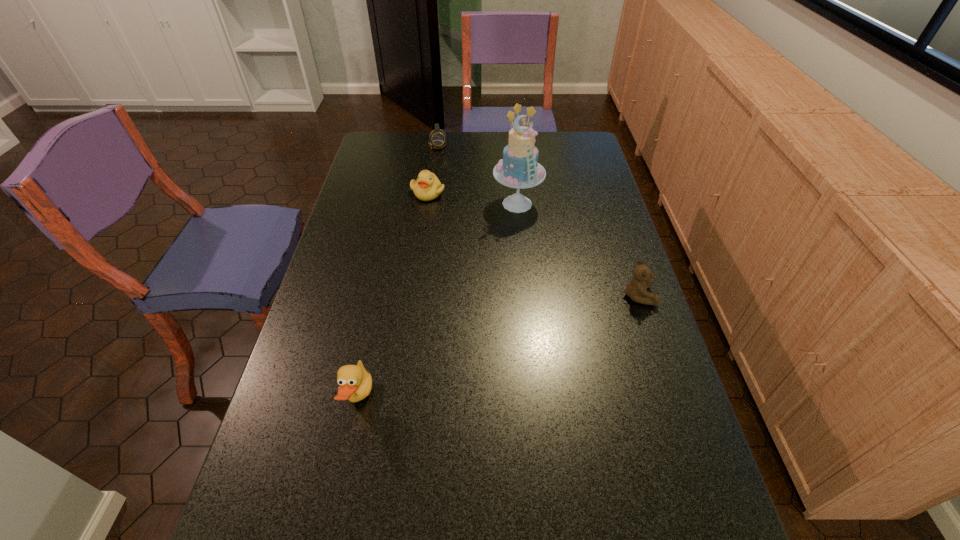
The height and width of the screenshot is (540, 960). Identify the location of vacant area that lies between the rightmost object and the duckling. (533, 244).

Locate an element on the screen. Image resolution: width=960 pixels, height=540 pixels. blank region between the rightmost object and the compass is located at coordinates (539, 220).

I want to click on free spot between the cake and the duckling, so click(x=472, y=198).

What are the coordinates of `vacant space that's between the duckling and the teddy bear` in the screenshot? It's located at [x=533, y=244].

Identify the location of object that is the nearest to the compass. This screenshot has height=540, width=960. (427, 187).

Locate which object is the second closest to the duckling. Please provide its 2D coordinates. Your answer should be formatted as a tuple, i.e. [(x, y)], where the tuple contains the x and y coordinates of a point satisfying the conditions above.

[(437, 138)]